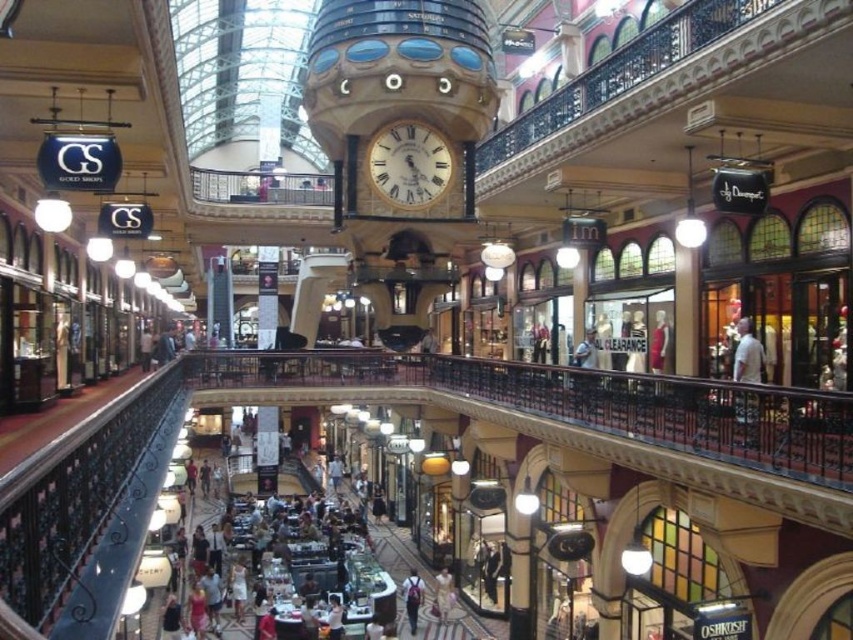
Who is positioned more to the left, gold metallic clock at center or matte gray backpack at center?

matte gray backpack at center is more to the left.

From the picture: Who is taller, gold metallic clock at center or matte gray backpack at center?

With more height is matte gray backpack at center.

Between point (437, 164) and point (405, 595), which one is positioned in front?

Point (437, 164) is in front.

What are the coordinates of `gold metallic clock at center` in the screenshot? It's located at (409, 164).